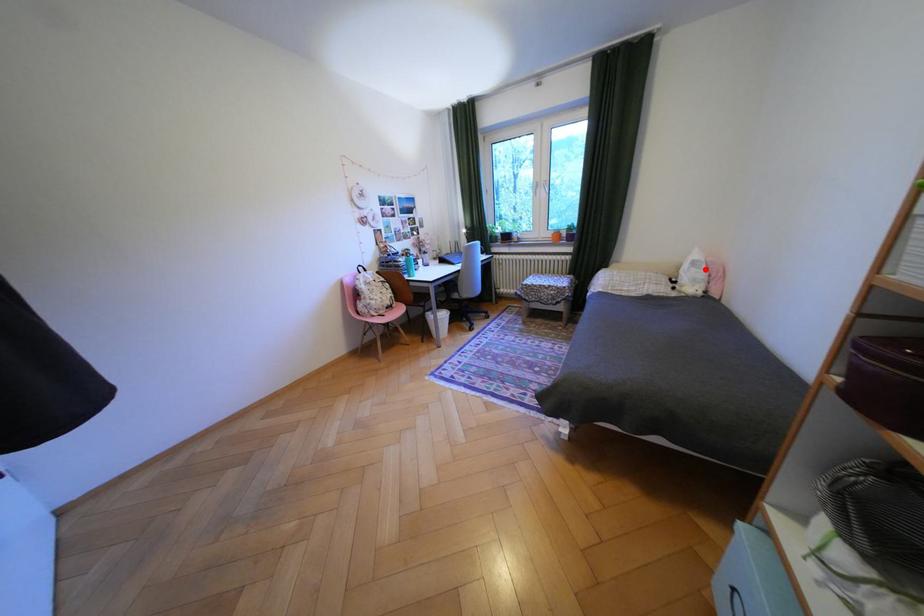
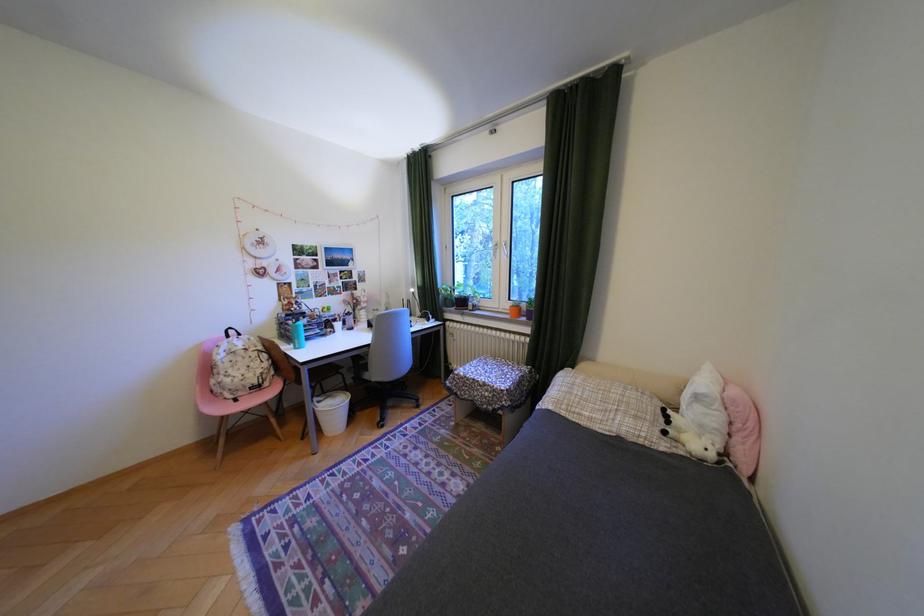
Where in the second image is the point corresponding to the highlighted location from the first image?

(710, 408)